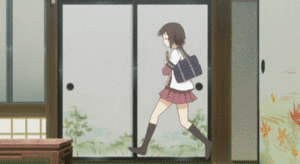
At what (x,y) coordinates should I click in order to perform the action: click on cabinets. Please return your answer as a coordinate pair (x, y). This screenshot has height=164, width=300. Looking at the image, I should click on (96, 50).